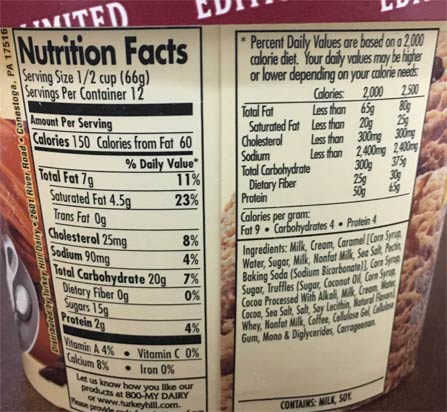
You are a GUI agent. You are given a task and a screenshot of the screen. Output one action in this format:
    pyautogui.click(x=<x>, y=<y>)
    Task: Click on the table
    This screenshot has height=412, width=447.
    Given the screenshot: What is the action you would take?
    pyautogui.click(x=21, y=397)